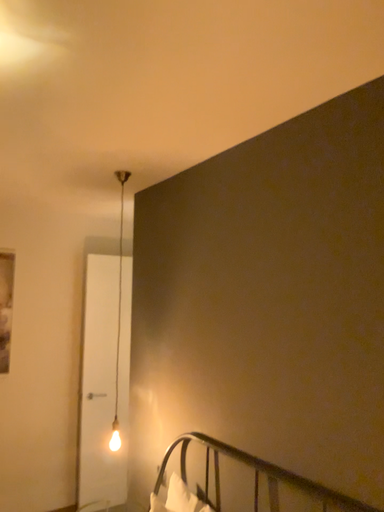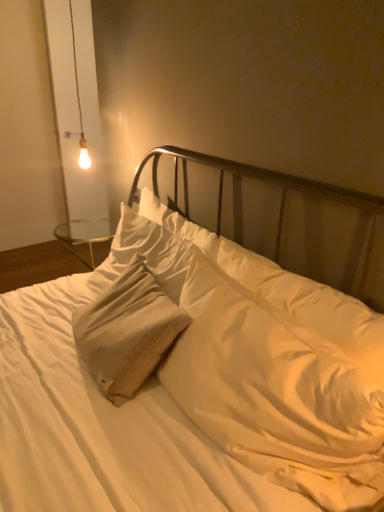
Question: Which way did the camera rotate in the video?

Choices:
 (A) rotated upward
 (B) rotated downward

Answer: (B)